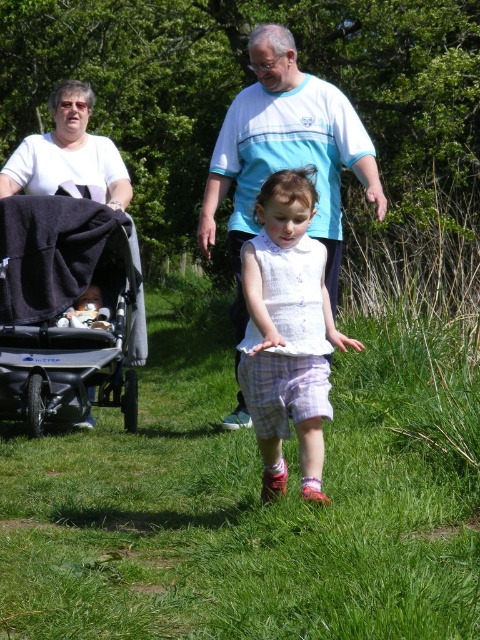
You are taking a photo of the scene and want to focus on both the point at point (108,259) and the point at point (267,140). Which point should you focus on to ensure both are in focus?

You should focus on point (108,259) because it is closer to the camera than point (267,140). By focusing on the closer point, the depth of field will likely include the farther point as well, ensuring both are in focus.

You are standing at the point with coordinates (288,332) in the image. What object are you currently standing on?

You are standing on the white cotton dress at center.